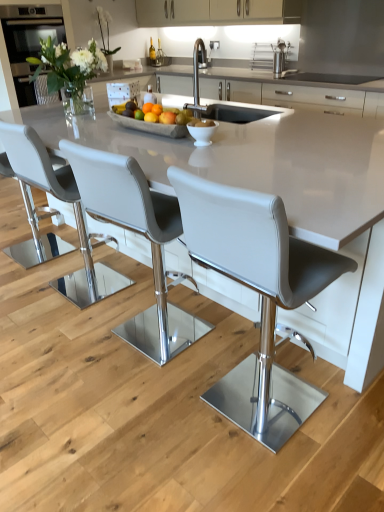
This screenshot has width=384, height=512. In order to click on free space to the back side of matte gray chair at center, which is the fourth chair in left-to-right order in this screenshot , I will do `click(232, 344)`.